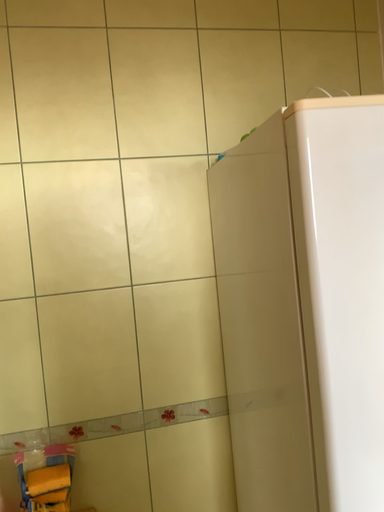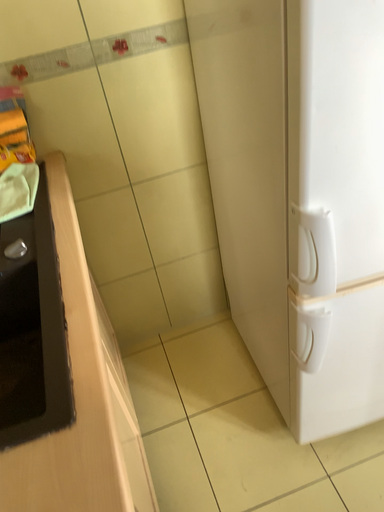
Question: Which way did the camera rotate in the video?

Choices:
 (A) rotated upward
 (B) rotated downward

Answer: (B)